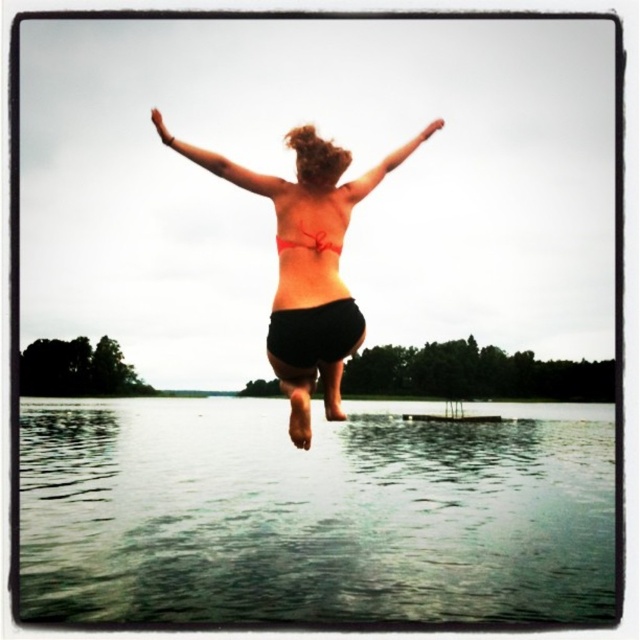
Question: Which object is closer to the camera taking this photo?

Choices:
 (A) clear water at lower center
 (B) matte skin arm at upper center
 (C) matte black bikini at center

Answer: (C)

Question: Which point is farther from the camera taking this photo?

Choices:
 (A) click(380, 612)
 (B) click(314, 246)
 (C) click(433, 132)
 (D) click(256, 172)

Answer: (A)

Question: Can you confirm if clear water at lower center is bigger than matte orange bikini top at upper center?

Choices:
 (A) yes
 (B) no

Answer: (A)

Question: Which of the following is the closest to the observer?

Choices:
 (A) matte white bikini top at upper center
 (B) matte orange bikini top at upper center
 (C) matte skin arm at upper center
 (D) clear water at lower center

Answer: (C)

Question: Does clear water at lower center appear on the left side of matte orange bikini top at upper center?

Choices:
 (A) yes
 (B) no

Answer: (A)

Question: Can you confirm if matte orange bikini top at upper center is positioned to the left of matte white bikini top at upper center?

Choices:
 (A) yes
 (B) no

Answer: (B)